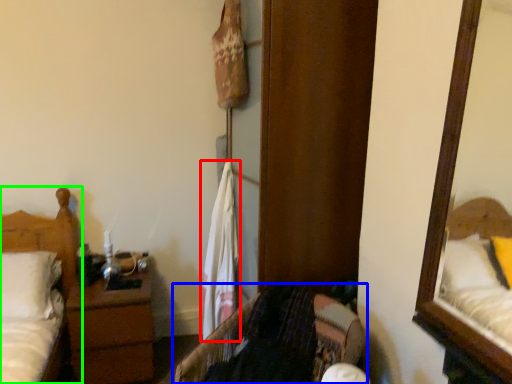
Question: Considering the real-world distances, which object is closest to laundry (highlighted by a red box)? furniture (highlighted by a blue box) or bed (highlighted by a green box).

Choices:
 (A) furniture
 (B) bed

Answer: (A)